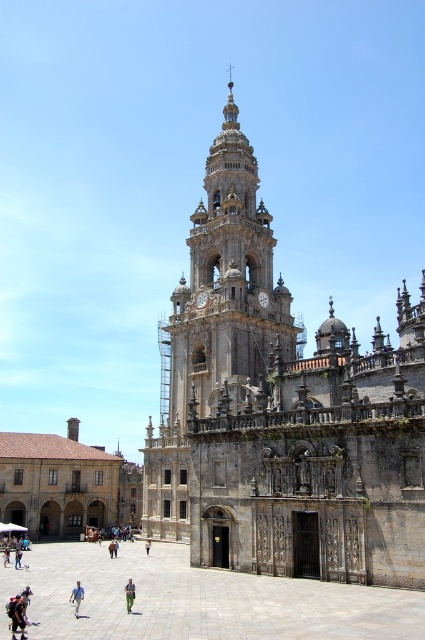
You are a tourist standing in front of the grand historical building. You notice the golden stone tower at center and the green fabric pants at center. Which object is taller?

The golden stone tower at center is taller than the green fabric pants at center.

Based on the scene description, what is located at the coordinates point (223,289)?

The golden stone tower at center is located at point (223,289).

You are standing on the stone paved square at center and want to take a photo of the blue fabric pants at lower left. Which direction should you face to capture the pants in your shot?

The blue fabric pants at lower left are positioned above the stone paved square at center, so you should look upward to capture the pants in your photo.